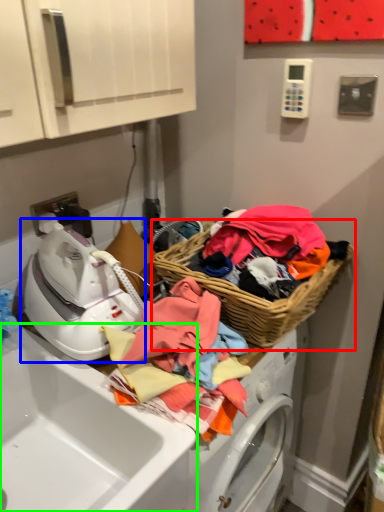
Question: Considering the real-world distances, which object is farthest from picnic basket (highlighted by a red box)? washer (highlighted by a blue box) or sink (highlighted by a green box)?

Choices:
 (A) washer
 (B) sink

Answer: (B)